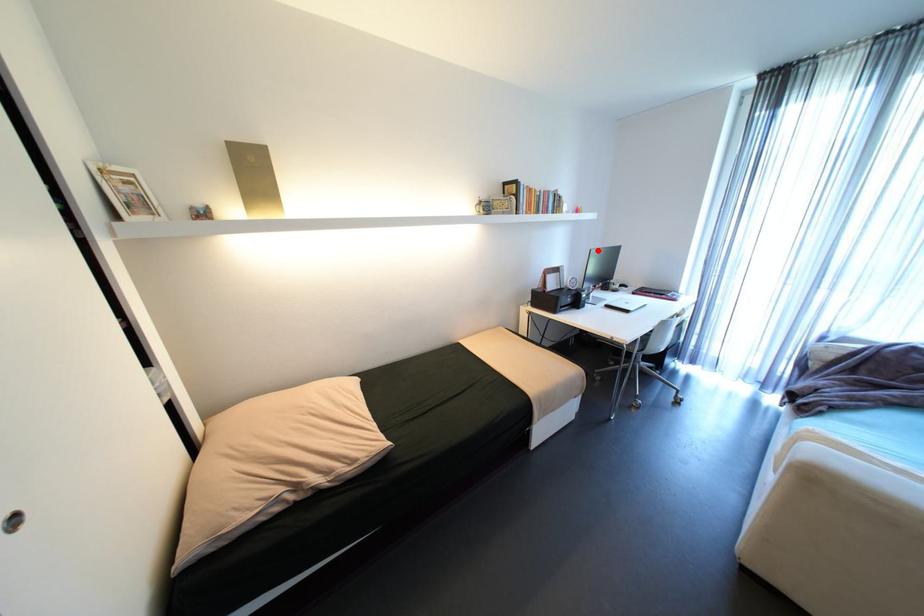
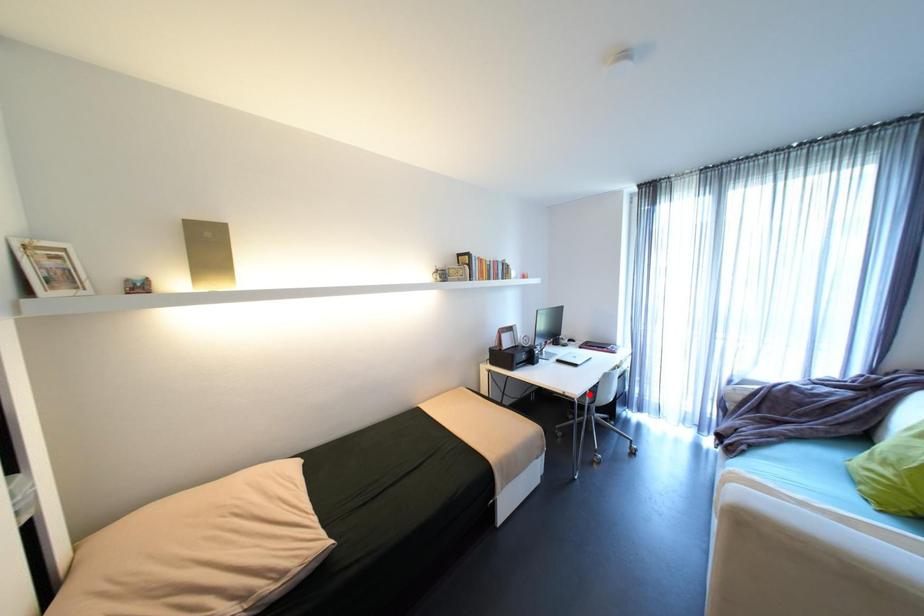
Based on the photo, I am providing you with two images of the same scene from different viewpoints. A red point is marked on the first image and another point is marked on the second image. Are the points marked in image1 and image2 representing the same 3D position?

No